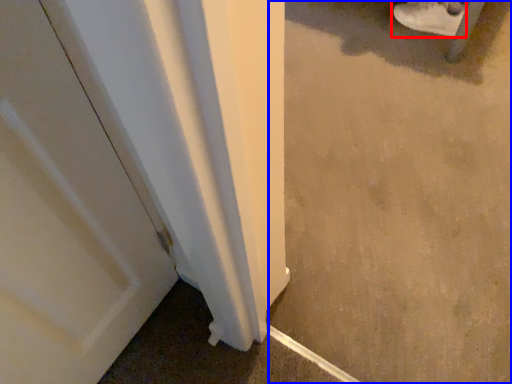
Question: Which object appears closest to the camera in this image, footwear (highlighted by a red box) or concrete (highlighted by a blue box)?

Choices:
 (A) footwear
 (B) concrete

Answer: (B)